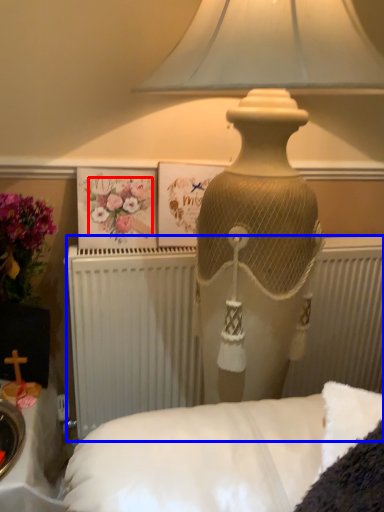
Question: Which object is closer to the camera taking this photo, flower (highlighted by a red box) or radiator (highlighted by a blue box)?

Choices:
 (A) flower
 (B) radiator

Answer: (B)